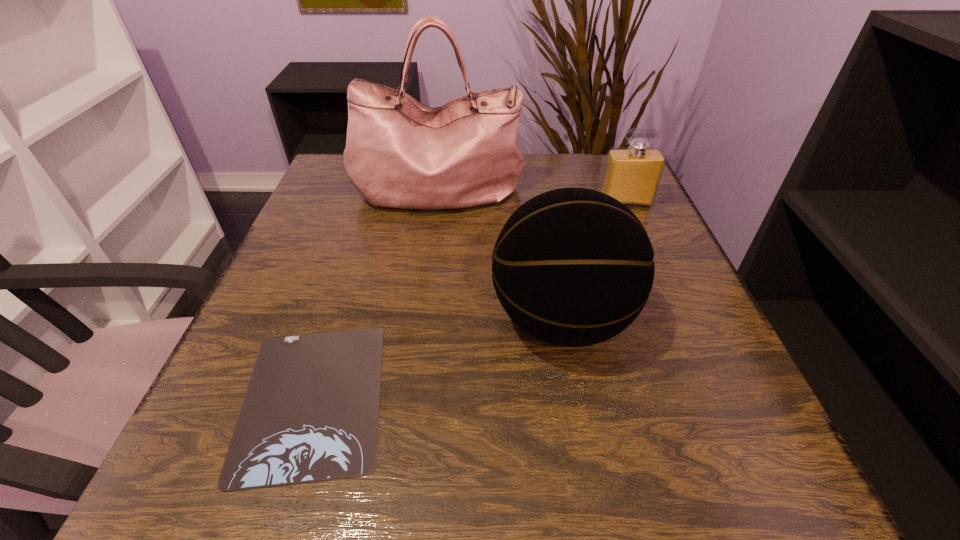
The image size is (960, 540). I want to click on perfume positioned at the far edge, so click(x=632, y=175).

Locate an element on the screen. object that is at the near edge is located at coordinates (310, 413).

Where is `handbag that is at the left edge`? The height and width of the screenshot is (540, 960). handbag that is at the left edge is located at coordinates (400, 153).

Find the location of `mousepad located in the left edge section of the desktop`. mousepad located in the left edge section of the desktop is located at coordinates (310, 413).

Identify the location of basketball located in the right edge section of the desktop. (573, 267).

Identify the location of perfume present at the right edge. (632, 175).

This screenshot has height=540, width=960. I want to click on object at the far left corner, so click(400, 153).

At what (x,y) coordinates should I click in order to perform the action: click on object situated at the near left corner. Please return your answer as a coordinate pair (x, y). Looking at the image, I should click on (310, 413).

Locate an element on the screen. object positioned at the far right corner is located at coordinates (632, 175).

Where is `free space at the near edge of the desktop`? The width and height of the screenshot is (960, 540). free space at the near edge of the desktop is located at coordinates pyautogui.click(x=591, y=474).